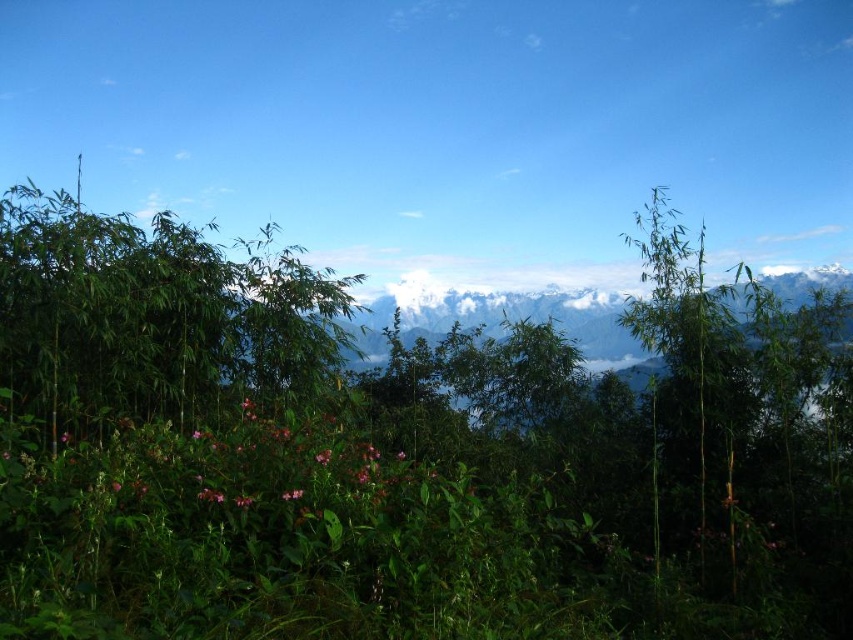
You are standing in the serene landscape described and want to locate the green bamboo at left. According to the coordinates provided, where should you look to find it?

The green bamboo at left is located at the 2D coordinates point (151,314).

You are standing in the bamboo forest and want to reach a clearing 5 meters away from the green bamboo at left. Can you make it in one step?

The green bamboo at left is 4.99 meters away from the viewer. Since the clearing is 5 meters away, you are just 1 centimeter short of reaching it in one step.

You are a gardener examining the pink matte flowers at lower left and the pink matte flower at lower left in the image. Which one is located closer to the ground?

The pink matte flowers at lower left is positioned under the pink matte flower at lower left, so it is closer to the ground.